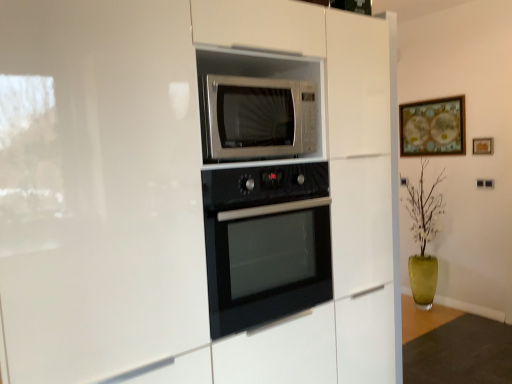
Question: Could you tell me if wooden picture frame at upper right, the second picture frame when ordered from back to front, is turned towards black glass oven at center?

Choices:
 (A) no
 (B) yes

Answer: (B)

Question: From the image's perspective, does wooden picture frame at upper right, the second picture frame when ordered from back to front, appear lower than black glass oven at center?

Choices:
 (A) yes
 (B) no

Answer: (B)

Question: Considering the relative sizes of wooden picture frame at upper right, which appears as the 2th picture frame when viewed from the left, and black glass oven at center in the image provided, is wooden picture frame at upper right, which appears as the 2th picture frame when viewed from the left, wider than black glass oven at center?

Choices:
 (A) yes
 (B) no

Answer: (B)

Question: Does wooden picture frame at upper right, which appears as the 2th picture frame when viewed from the left, have a smaller size compared to black glass oven at center?

Choices:
 (A) yes
 (B) no

Answer: (A)

Question: Can you confirm if wooden picture frame at upper right, the 1th picture frame when ordered from front to back, is taller than black glass oven at center?

Choices:
 (A) yes
 (B) no

Answer: (B)

Question: From a real-world perspective, is wooden picture frame at upper right, which appears as the 2th picture frame when viewed from the left, positioned over black glass oven at center based on gravity?

Choices:
 (A) no
 (B) yes

Answer: (B)

Question: From the image's perspective, is wooden framed map at upper right, arranged as the first picture frame when viewed from the left, on top of satin silver microwave at center?

Choices:
 (A) no
 (B) yes

Answer: (B)

Question: Is satin silver microwave at center at the back of wooden framed map at upper right, which appears as the second picture frame when viewed from the front?

Choices:
 (A) yes
 (B) no

Answer: (B)

Question: Considering the relative sizes of wooden framed map at upper right, which is the second picture frame from right to left, and satin silver microwave at center in the image provided, is wooden framed map at upper right, which is the second picture frame from right to left, shorter than satin silver microwave at center?

Choices:
 (A) no
 (B) yes

Answer: (A)

Question: Can you confirm if wooden framed map at upper right, arranged as the first picture frame when viewed from the left, is smaller than satin silver microwave at center?

Choices:
 (A) yes
 (B) no

Answer: (B)

Question: Considering the relative positions of wooden framed map at upper right, which appears as the second picture frame when viewed from the front, and satin silver microwave at center in the image provided, is wooden framed map at upper right, which appears as the second picture frame when viewed from the front, to the right of satin silver microwave at center from the viewer's perspective?

Choices:
 (A) no
 (B) yes

Answer: (B)

Question: Does wooden framed map at upper right, arranged as the first picture frame when viewed from the left, come behind satin silver microwave at center?

Choices:
 (A) no
 (B) yes

Answer: (B)

Question: From the image's perspective, is black glass oven at center on satin silver microwave at center?

Choices:
 (A) yes
 (B) no

Answer: (B)